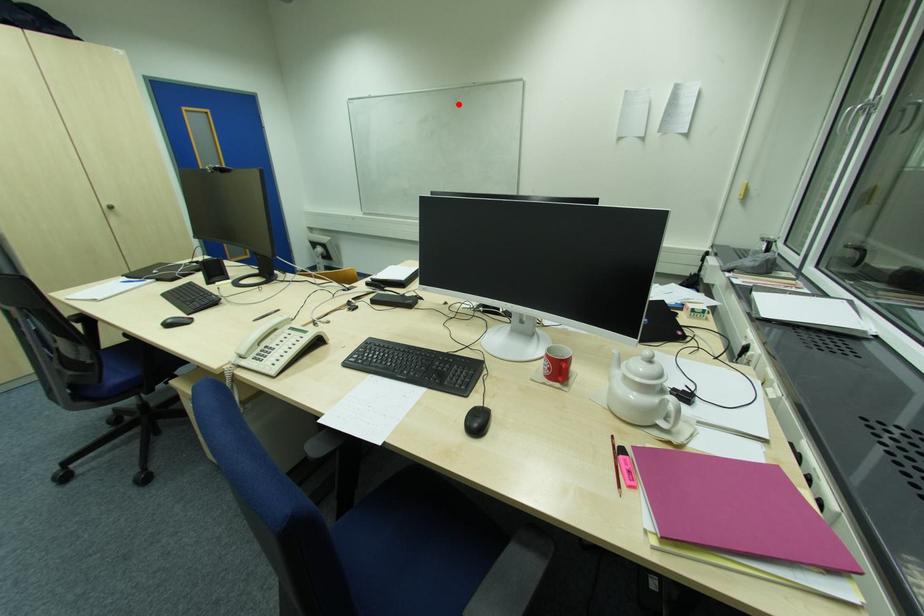
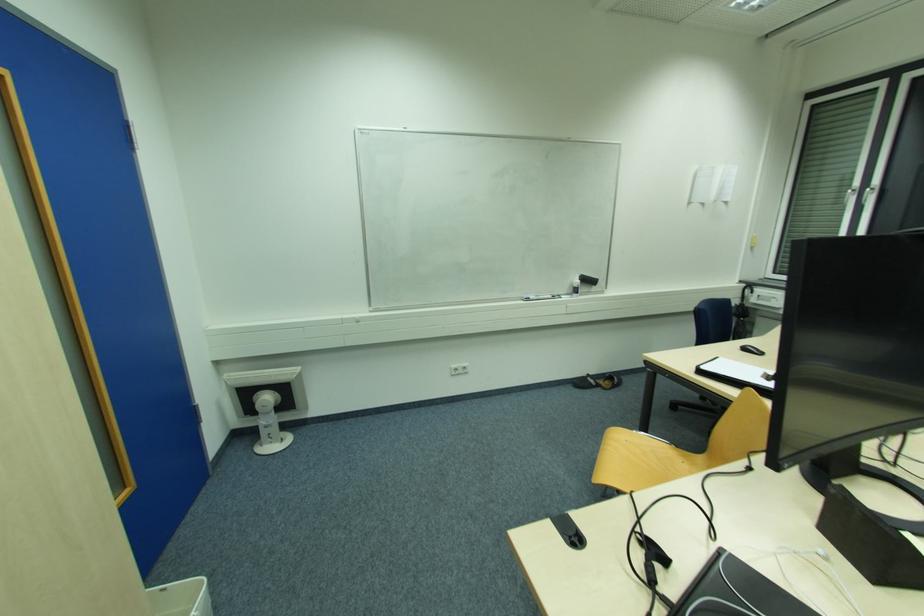
Find the pixel in the second image that matches the highlighted location in the first image.

(550, 158)